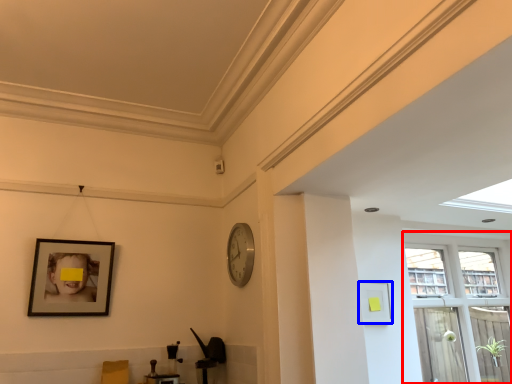
Question: Among these objects, which one is farthest to the camera, window (highlighted by a red box) or picture frame (highlighted by a blue box)?

Choices:
 (A) window
 (B) picture frame

Answer: (A)